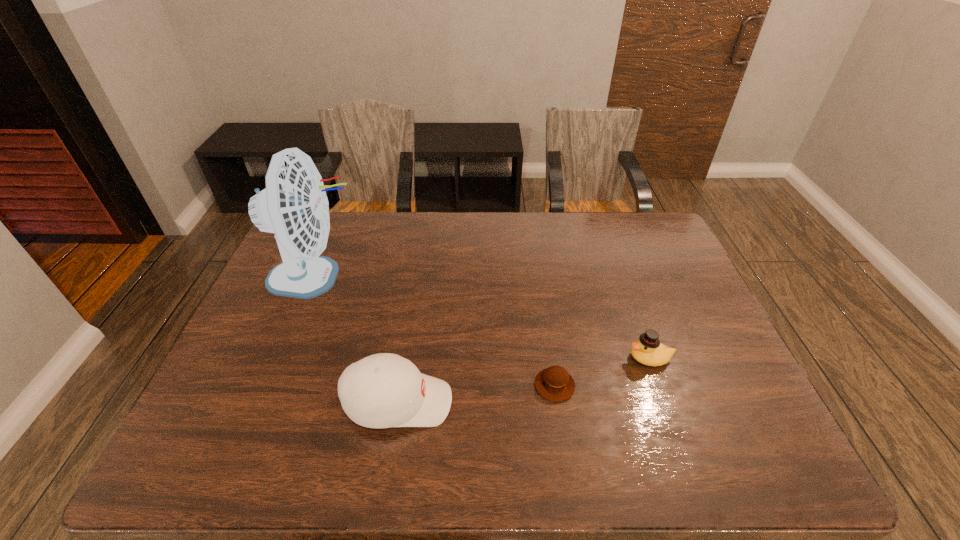
What are the coordinates of `fan` in the screenshot? It's located at (294, 205).

This screenshot has height=540, width=960. What are the coordinates of `the farthest object` in the screenshot? It's located at (294, 205).

You are a GUI agent. You are given a task and a screenshot of the screen. Output one action in this format:
    pyautogui.click(x=<x>, y=<y>)
    Task: Click on the third object from right to left
    
    Given the screenshot: What is the action you would take?
    pyautogui.click(x=383, y=390)

The height and width of the screenshot is (540, 960). I want to click on baseball cap, so click(383, 390).

Where is `the rightmost object`? The image size is (960, 540). the rightmost object is located at coordinates [648, 350].

The height and width of the screenshot is (540, 960). I want to click on duck, so click(648, 350).

What are the coordinates of `the second object from right to left` in the screenshot? It's located at (554, 383).

The height and width of the screenshot is (540, 960). I want to click on muffin, so click(x=554, y=383).

Locate an element on the screen. The height and width of the screenshot is (540, 960). free point located on the grille of the fan is located at coordinates (437, 278).

You are a GUI agent. You are given a task and a screenshot of the screen. Output one action in this format:
    pyautogui.click(x=<x>, y=<y>)
    Task: Click on the vacant region located on the front-facing side of the baseball cap
    
    Given the screenshot: What is the action you would take?
    pyautogui.click(x=609, y=402)